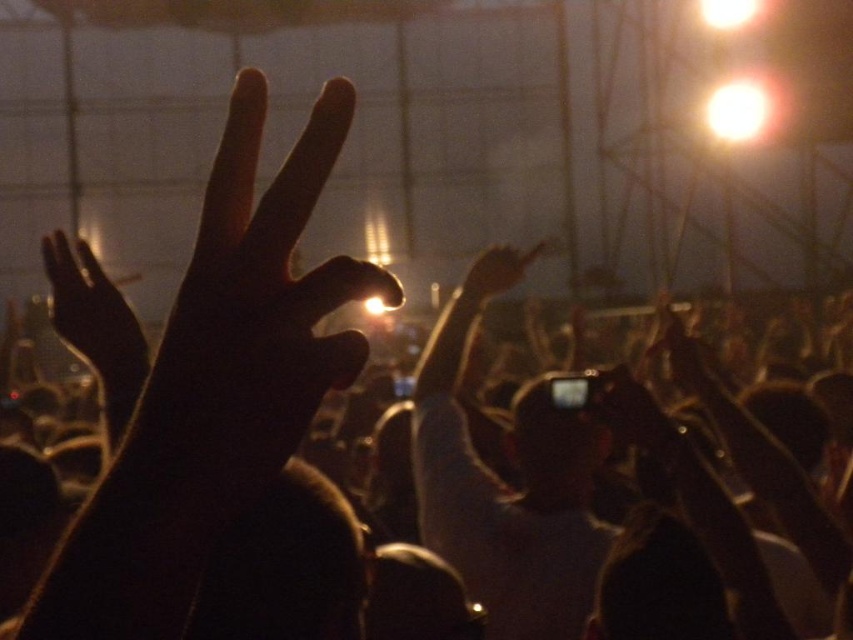
You are a photographer trying to capture the black matte hand at center in the concert scene. The concert venue uses a coordinate system where the bottom left corner is the origin point. Where should you aim your camera to ensure the hand is in the frame?

The black matte hand at center is located at point 0.606 on the x axis and 0.253 on the y axis. You should aim your camera towards those coordinates to capture it.